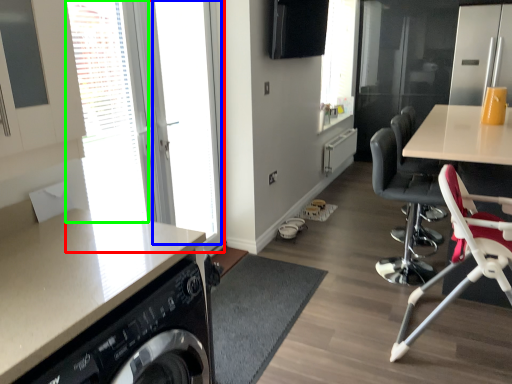
Question: Considering the real-world distances, which object is closest to window (highlighted by a red box)? window screen (highlighted by a blue box) or window (highlighted by a green box).

Choices:
 (A) window screen
 (B) window

Answer: (A)